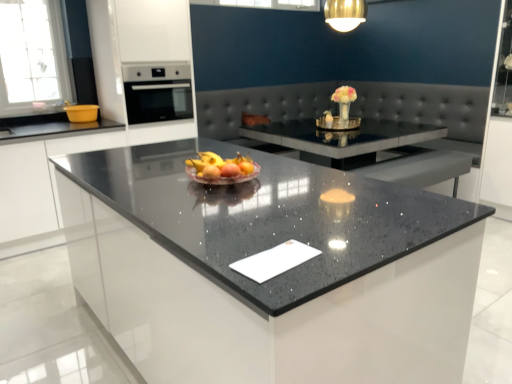
Question: From a real-world perspective, is yellow plastic bowl at left on top of white glossy cabinet at left, the 1th cabinetry viewed from the left?

Choices:
 (A) no
 (B) yes

Answer: (B)

Question: From a real-world perspective, is yellow plastic bowl at left physically below white glossy cabinet at left, the 1th cabinetry viewed from the left?

Choices:
 (A) no
 (B) yes

Answer: (A)

Question: Is yellow plastic bowl at left looking in the opposite direction of white glossy cabinet at left, marked as the 2th cabinetry in a right-to-left arrangement?

Choices:
 (A) yes
 (B) no

Answer: (B)

Question: Is yellow plastic bowl at left completely or partially outside of white glossy cabinet at left, the 1th cabinetry viewed from the left?

Choices:
 (A) no
 (B) yes

Answer: (B)

Question: Does yellow plastic bowl at left have a larger size compared to white glossy cabinet at left, the 1th cabinetry viewed from the left?

Choices:
 (A) yes
 (B) no

Answer: (B)

Question: Is white glossy cabinet at left, marked as the 2th cabinetry in a right-to-left arrangement, located within yellow plastic bowl at left?

Choices:
 (A) yes
 (B) no

Answer: (B)

Question: Considering the relative sizes of black granite countertop at center and white glossy cabinet at left, marked as the 2th cabinetry in a right-to-left arrangement, in the image provided, is black granite countertop at center bigger than white glossy cabinet at left, marked as the 2th cabinetry in a right-to-left arrangement,?

Choices:
 (A) no
 (B) yes

Answer: (B)

Question: Are black granite countertop at center and white glossy cabinet at left, the 1th cabinetry viewed from the left, making contact?

Choices:
 (A) yes
 (B) no

Answer: (B)

Question: Does black granite countertop at center have a greater height compared to white glossy cabinet at left, the 1th cabinetry viewed from the left?

Choices:
 (A) no
 (B) yes

Answer: (B)

Question: From a real-world perspective, is black granite countertop at center over white glossy cabinet at left, the 1th cabinetry viewed from the left?

Choices:
 (A) no
 (B) yes

Answer: (B)

Question: Is black granite countertop at center at the left side of white glossy cabinet at left, the 1th cabinetry viewed from the left?

Choices:
 (A) no
 (B) yes

Answer: (A)

Question: Could white glossy cabinet at left, marked as the 2th cabinetry in a right-to-left arrangement, be considered to be inside black granite countertop at center?

Choices:
 (A) no
 (B) yes

Answer: (A)

Question: From the image's perspective, is glossy white oven at upper left, which is the 2th cabinetry from left to right, below yellow plastic bowl at left?

Choices:
 (A) yes
 (B) no

Answer: (B)